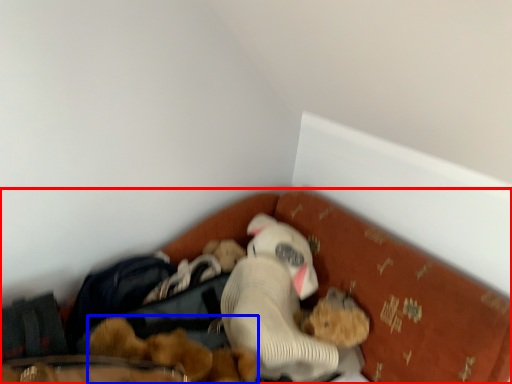
Question: Which of the following is the farthest to the observer, bed (highlighted by a red box) or toy (highlighted by a blue box)?

Choices:
 (A) bed
 (B) toy

Answer: (B)